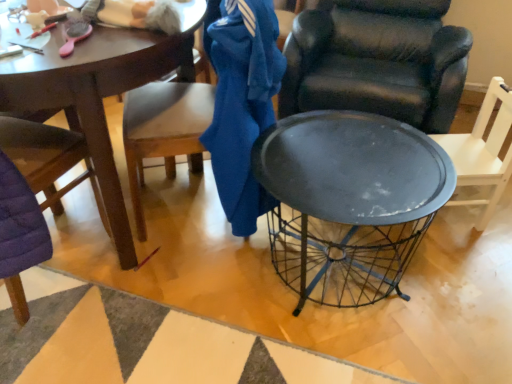
Identify the location of free space on the front side of matte black chair at right, positioned as the fourth chair in left-to-right order. The height and width of the screenshot is (384, 512). (464, 256).